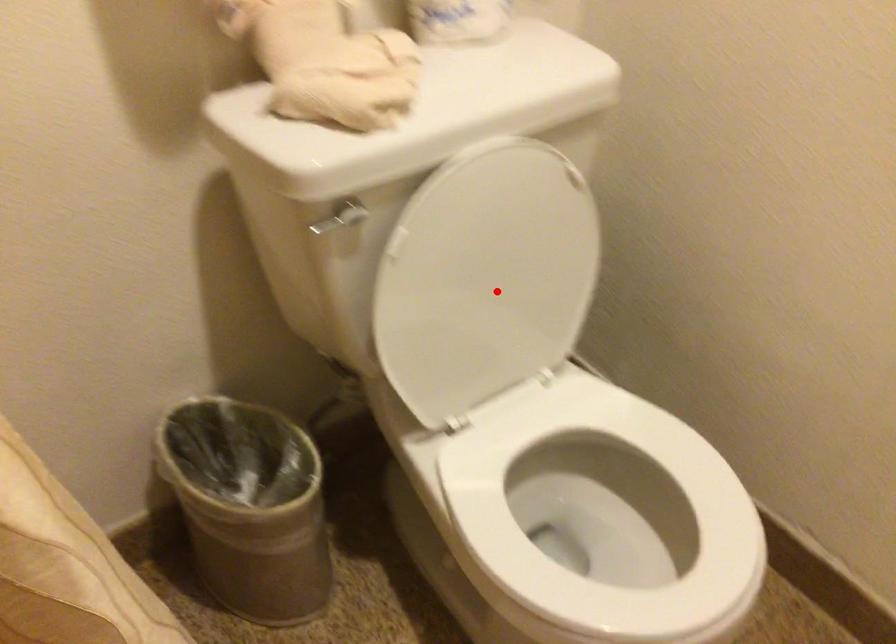
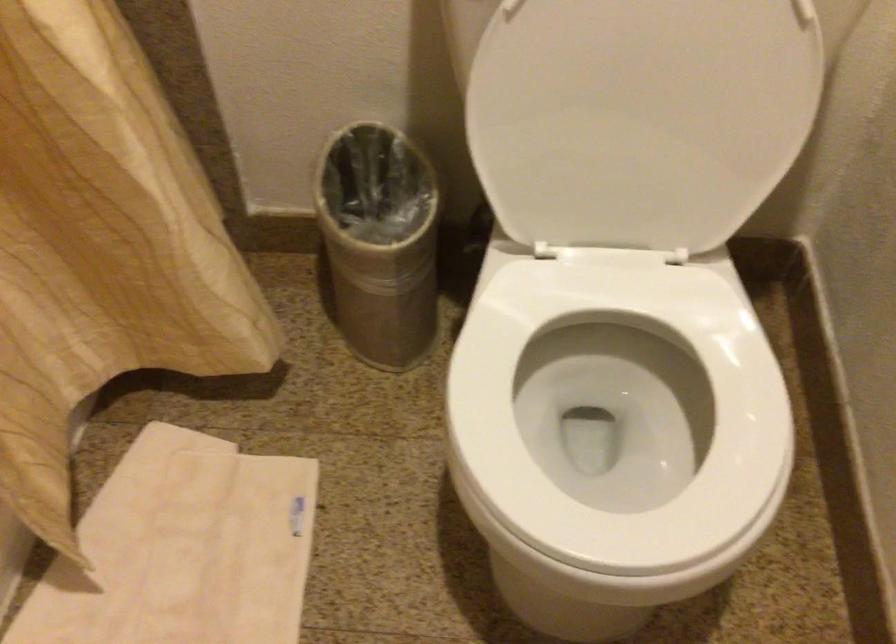
In the second image, find the point that corresponds to the highlighted location in the first image.

(640, 118)